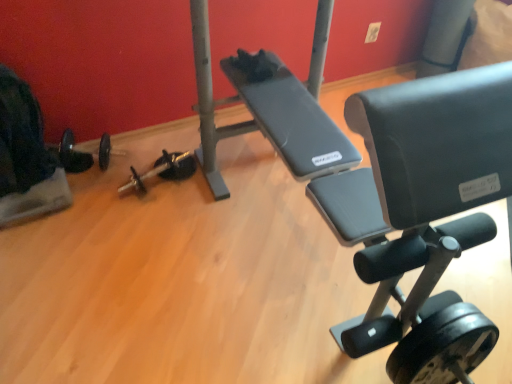
Question: Can you confirm if velvet black swivel chair at left is smaller than black rubber dumbbell at lower left, marked as the first dumbbell in a left-to-right arrangement?

Choices:
 (A) yes
 (B) no

Answer: (B)

Question: Is velvet black swivel chair at left at the right side of black rubber dumbbell at lower left, placed as the second dumbbell when sorted from top to bottom?

Choices:
 (A) yes
 (B) no

Answer: (B)

Question: Would you say black rubber dumbbell at lower left, placed as the 2th dumbbell when sorted from bottom to top, is part of velvet black swivel chair at left's contents?

Choices:
 (A) no
 (B) yes

Answer: (A)

Question: Is velvet black swivel chair at left wider than black rubber dumbbell at lower left, the 2th dumbbell from the front?

Choices:
 (A) yes
 (B) no

Answer: (A)

Question: Is velvet black swivel chair at left shorter than black rubber dumbbell at lower left, arranged as the 2th dumbbell when viewed from the back?

Choices:
 (A) no
 (B) yes

Answer: (A)

Question: Can you confirm if velvet black swivel chair at left is positioned to the left of black rubber dumbbell at lower left, the 2th dumbbell from the front?

Choices:
 (A) no
 (B) yes

Answer: (B)

Question: Does velvet black swivel chair at left have a greater height compared to black rubber dumbbell at lower right, arranged as the 1th dumbbell when viewed from the right?

Choices:
 (A) no
 (B) yes

Answer: (B)

Question: Would you say black rubber dumbbell at lower right, the third dumbbell positioned from the top, is part of velvet black swivel chair at left's contents?

Choices:
 (A) yes
 (B) no

Answer: (B)

Question: Is velvet black swivel chair at left facing towards black rubber dumbbell at lower right, the third dumbbell positioned from the top?

Choices:
 (A) no
 (B) yes

Answer: (A)

Question: From the image's perspective, would you say velvet black swivel chair at left is positioned over black rubber dumbbell at lower right, the third dumbbell positioned from the top?

Choices:
 (A) yes
 (B) no

Answer: (A)

Question: Considering the relative sizes of velvet black swivel chair at left and black rubber dumbbell at lower right, the 3th dumbbell when ordered from back to front, in the image provided, is velvet black swivel chair at left bigger than black rubber dumbbell at lower right, the 3th dumbbell when ordered from back to front,?

Choices:
 (A) no
 (B) yes

Answer: (B)

Question: Does velvet black swivel chair at left touch black rubber dumbbell at lower right, the 3th dumbbell when ordered from back to front?

Choices:
 (A) no
 (B) yes

Answer: (A)

Question: Is black rubber dumbbell at center, marked as the 3th dumbbell in a front-to-back arrangement, aimed at black rubber dumbbell at lower right, the third dumbbell positioned from the top?

Choices:
 (A) no
 (B) yes

Answer: (A)